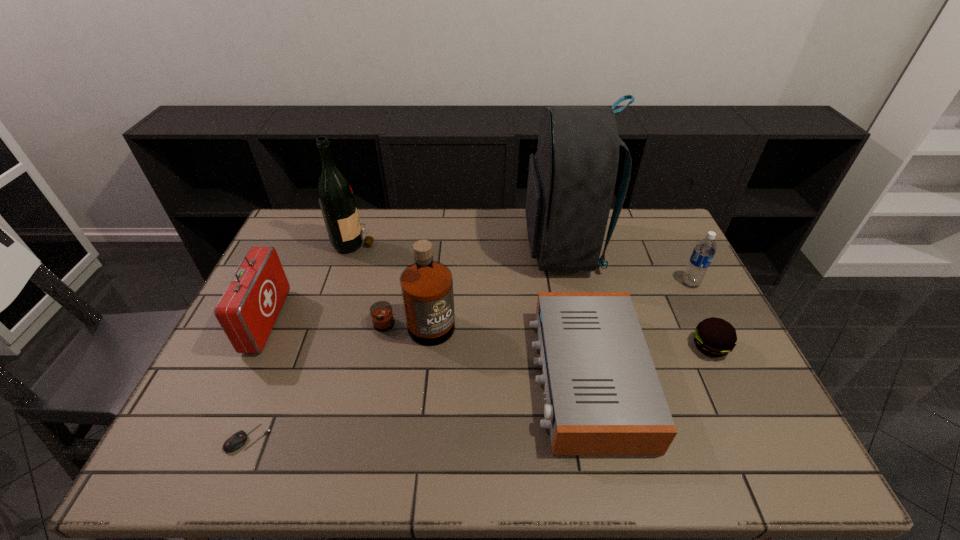
Locate an element on the screen. The image size is (960, 540). free space between the tallest object and the mouse is located at coordinates (406, 343).

The width and height of the screenshot is (960, 540). What are the coordinates of `free area in between the patty and the water bottle` in the screenshot? It's located at 700,315.

Find the location of a particular element. This screenshot has width=960, height=540. vacant space in between the first-aid kit and the wine bottle is located at coordinates (311, 281).

Image resolution: width=960 pixels, height=540 pixels. I want to click on object identified as the third closest to the liquor, so click(x=335, y=195).

Locate which object ranks in proximity to the sixth shortest object. Please provide its 2D coordinates. Your answer should be formatted as a tuple, i.e. [(x, y)], where the tuple contains the x and y coordinates of a point satisfying the conditions above.

[(603, 396)]

This screenshot has width=960, height=540. In order to click on vacant point that satisfies the following two spatial constraints: 1. on the front-facing side of the water bottle; 2. on the right side of the tallest object in this screenshot , I will do `click(570, 283)`.

At what (x,y) coordinates should I click in order to perform the action: click on vacant space that satisfies the following two spatial constraints: 1. on the front-facing side of the tallest object; 2. on the front side of the shortest object. Please return your answer as a coordinate pair (x, y). The width and height of the screenshot is (960, 540). Looking at the image, I should click on (604, 438).

The width and height of the screenshot is (960, 540). In order to click on free space that satisfies the following two spatial constraints: 1. on the front-facing side of the tallest object; 2. on the front label of the fifth object from right to left in this screenshot , I will do `click(580, 328)`.

The width and height of the screenshot is (960, 540). What are the coordinates of `free point that satisfies the following two spatial constraints: 1. on the side of the mouse with the first aid cross symbol; 2. on the right side of the first-aid kit` in the screenshot? It's located at (212, 438).

This screenshot has height=540, width=960. Find the location of `free space that satisfies the following two spatial constraints: 1. on the back side of the patty; 2. on the front-facing side of the backpack`. free space that satisfies the following two spatial constraints: 1. on the back side of the patty; 2. on the front-facing side of the backpack is located at coordinates (663, 248).